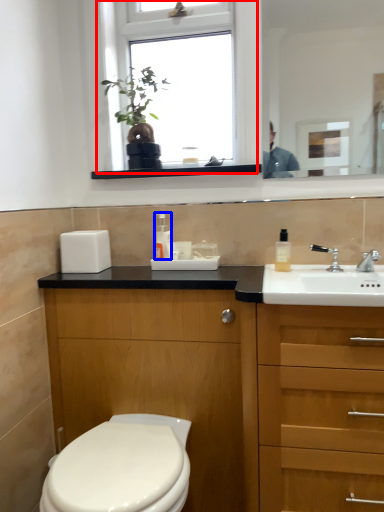
Question: Which object appears closest to the camera in this image, window (highlighted by a red box) or toiletry (highlighted by a blue box)?

Choices:
 (A) window
 (B) toiletry

Answer: (A)